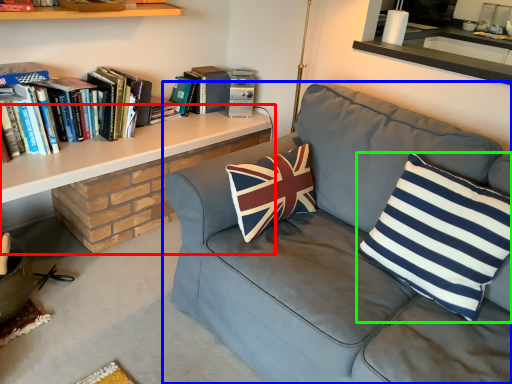
Question: Based on their relative distances, which object is nearer to table (highlighted by a red box)? Choose from studio couch (highlighted by a blue box) and pillow (highlighted by a green box).

Choices:
 (A) studio couch
 (B) pillow

Answer: (A)